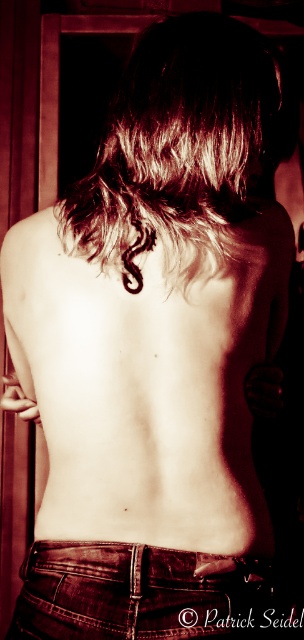
How much distance is there between dark brown wavy hair at center and jeans at lower center?

They are 17.67 inches apart.

Consider the image. Between dark brown wavy hair at center and jeans at lower center, which one is positioned higher?

Positioned higher is dark brown wavy hair at center.

Who is more distant from viewer, (x=230, y=188) or (x=125, y=554)?

Positioned behind is point (x=230, y=188).

Identify the location of dark brown wavy hair at center. (185, 141).